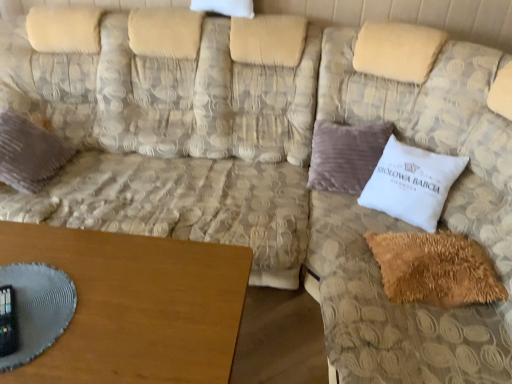
Describe the element at coordinates (435, 268) in the screenshot. I see `brown fuzzy pillow at lower right, placed as the second pillow when sorted from left to right` at that location.

This screenshot has width=512, height=384. Describe the element at coordinates (29, 153) in the screenshot. I see `velvet purple pillow at left, which ranks as the first pillow in left-to-right order` at that location.

In order to face white soft pillow at center right, the third pillow from the left, should I rotate leftwards or rightwards?

It's best to rotate right around 19.901 degrees.

Describe the element at coordinates (411, 183) in the screenshot. I see `white soft pillow at center right, the third pillow from the left` at that location.

Where is `brown fuzzy pillow at lower right, placed as the second pillow when sorted from left to right`? brown fuzzy pillow at lower right, placed as the second pillow when sorted from left to right is located at coordinates (435, 268).

Between point (80, 171) and point (438, 186), which one is positioned behind?

The point (80, 171) is farther.

Is beige textured couch at center, the 2th couch when ordered from right to left, positioned before white soft pillow at center right, the third pillow from the left?

Yes.

Could you tell me if beige textured couch at center, which appears as the first couch when viewed from the left, is facing white soft pillow at center right, placed as the first pillow when sorted from right to left?

No, beige textured couch at center, which appears as the first couch when viewed from the left, is not turned towards white soft pillow at center right, placed as the first pillow when sorted from right to left.

Based on their sizes in the image, would you say beige textured couch at center, the 2th couch when ordered from right to left, is bigger or smaller than white soft pillow at center right, placed as the first pillow when sorted from right to left?

Considering their sizes, beige textured couch at center, the 2th couch when ordered from right to left, takes up more space than white soft pillow at center right, placed as the first pillow when sorted from right to left.

From the image's perspective, is beige textured couch at center, which appears as the first couch when viewed from the left, below brown fuzzy pillow at lower right, positioned as the 2th pillow in right-to-left order?

No, from the image's perspective, beige textured couch at center, which appears as the first couch when viewed from the left, is not below brown fuzzy pillow at lower right, positioned as the 2th pillow in right-to-left order.

Is the depth of beige textured couch at center, which appears as the first couch when viewed from the left, less than that of brown fuzzy pillow at lower right, placed as the second pillow when sorted from left to right?

Yes, it is in front of brown fuzzy pillow at lower right, placed as the second pillow when sorted from left to right.

Which of these two, beige textured couch at center, which appears as the first couch when viewed from the left, or brown fuzzy pillow at lower right, placed as the second pillow when sorted from left to right, stands shorter?

brown fuzzy pillow at lower right, placed as the second pillow when sorted from left to right, is shorter.

Can you confirm if brown fuzzy pillow at lower right, positioned as the 2th pillow in right-to-left order, is positioned to the right of beige textured couch at center, which appears as the first couch when viewed from the left?

Yes.

Considering the points (418, 277) and (69, 98), which point is in front, point (418, 277) or point (69, 98)?

The point (418, 277) is closer to the camera.

Is brown fuzzy pillow at lower right, positioned as the 2th pillow in right-to-left order, completely or partially outside of beige textured couch at center, which appears as the first couch when viewed from the left?

brown fuzzy pillow at lower right, positioned as the 2th pillow in right-to-left order, is positioned outside beige textured couch at center, which appears as the first couch when viewed from the left.

Is velvet purple pillow at left, which is the third pillow from right to left, behind brown wooden table at lower left?

Yes, the depth of velvet purple pillow at left, which is the third pillow from right to left, is greater than that of brown wooden table at lower left.

Is velvet purple pillow at left, which is the third pillow from right to left, oriented away from brown wooden table at lower left?

No, velvet purple pillow at left, which is the third pillow from right to left,'s orientation is not away from brown wooden table at lower left.

Which is more to the right, velvet purple pillow at left, which ranks as the first pillow in left-to-right order, or brown wooden table at lower left?

From the viewer's perspective, brown wooden table at lower left appears more on the right side.

Starting from the velvet purple pillow at left, which is the third pillow from right to left, which pillow is the 1st one to the right? Please provide its 2D coordinates.

[(435, 268)]

Can you confirm if brown fuzzy pillow at lower right, placed as the second pillow when sorted from left to right, is thinner than velvet purple pillow at left, which ranks as the first pillow in left-to-right order?

In fact, brown fuzzy pillow at lower right, placed as the second pillow when sorted from left to right, might be wider than velvet purple pillow at left, which ranks as the first pillow in left-to-right order.

Is point (404, 266) closer or farther from the camera than point (18, 122)?

Clearly, point (404, 266) is closer to the camera than point (18, 122).

Considering their positions, is brown wooden table at lower left located in front of or behind brown fuzzy pillow at lower right, placed as the second pillow when sorted from left to right?

brown wooden table at lower left is positioned closer to the viewer than brown fuzzy pillow at lower right, placed as the second pillow when sorted from left to right.

Is brown wooden table at lower left completely or partially outside of brown fuzzy pillow at lower right, placed as the second pillow when sorted from left to right?

Yes, brown wooden table at lower left is located beyond the bounds of brown fuzzy pillow at lower right, placed as the second pillow when sorted from left to right.

Who is bigger, brown wooden table at lower left or brown fuzzy pillow at lower right, positioned as the 2th pillow in right-to-left order?

Bigger between the two is brown wooden table at lower left.

How many degrees apart are the facing directions of beige textured couch at center, the 2th couch when ordered from right to left, and beige textured couch at upper right, positioned as the 1th couch in right-to-left order?

beige textured couch at center, the 2th couch when ordered from right to left, and beige textured couch at upper right, positioned as the 1th couch in right-to-left order, are facing 89.9 degrees away from each other.

Is beige textured couch at upper right, positioned as the 1th couch in right-to-left order, at the back of beige textured couch at center, which appears as the first couch when viewed from the left?

No, beige textured couch at center, which appears as the first couch when viewed from the left, is not facing away from beige textured couch at upper right, positioned as the 1th couch in right-to-left order.

Would you say beige textured couch at center, the 2th couch when ordered from right to left, contains beige textured couch at upper right, marked as the 2th couch in a left-to-right arrangement?

No, beige textured couch at upper right, marked as the 2th couch in a left-to-right arrangement, is not a part of beige textured couch at center, the 2th couch when ordered from right to left.

From the picture: Can you confirm if beige textured couch at center, which appears as the first couch when viewed from the left, is wider than beige textured couch at upper right, positioned as the 1th couch in right-to-left order?

No.

You are a GUI agent. You are given a task and a screenshot of the screen. Output one action in this format:
    pyautogui.click(x=<x>, y=<y>)
    Task: Click on the couch that is the 1st object above the white soft pillow at center right, the third pillow from the left (from a real-world perspective)
    
    Given the screenshot: What is the action you would take?
    pyautogui.click(x=177, y=130)

Find the location of a particular element. This screenshot has height=384, width=512. the 3rd pillow positioned below the beige textured couch at center, which appears as the first couch when viewed from the left (from the image's perspective) is located at coordinates (435, 268).

When comparing their distances from white soft pillow at center right, the third pillow from the left, does brown fuzzy pillow at lower right, positioned as the 2th pillow in right-to-left order, or beige textured couch at center, which appears as the first couch when viewed from the left, seem further?

The object further to white soft pillow at center right, the third pillow from the left, is beige textured couch at center, which appears as the first couch when viewed from the left.

Estimate the real-world distances between objects in this image. Which object is further from velvet purple pillow at left, which is the third pillow from right to left, brown fuzzy pillow at lower right, positioned as the 2th pillow in right-to-left order, or white soft pillow at center right, the third pillow from the left?

brown fuzzy pillow at lower right, positioned as the 2th pillow in right-to-left order, is positioned further to the anchor velvet purple pillow at left, which is the third pillow from right to left.

Looking at this image, looking at the image, which one is located further to beige textured couch at center, the 2th couch when ordered from right to left, beige textured couch at upper right, positioned as the 1th couch in right-to-left order, or white soft pillow at center right, placed as the first pillow when sorted from right to left?

white soft pillow at center right, placed as the first pillow when sorted from right to left, lies further to beige textured couch at center, the 2th couch when ordered from right to left, than the other object.

In the scene shown: Looking at the image, which one is located closer to brown fuzzy pillow at lower right, placed as the second pillow when sorted from left to right, brown wooden table at lower left or beige textured couch at center, which appears as the first couch when viewed from the left?

The object closer to brown fuzzy pillow at lower right, placed as the second pillow when sorted from left to right, is brown wooden table at lower left.

From the picture: Based on their spatial positions, is beige textured couch at center, which appears as the first couch when viewed from the left, or brown fuzzy pillow at lower right, placed as the second pillow when sorted from left to right, closer to white soft pillow at center right, placed as the first pillow when sorted from right to left?

brown fuzzy pillow at lower right, placed as the second pillow when sorted from left to right, is positioned closer to the anchor white soft pillow at center right, placed as the first pillow when sorted from right to left.

Estimate the real-world distances between objects in this image. Which object is closer to beige textured couch at center, which appears as the first couch when viewed from the left, brown wooden table at lower left or velvet purple pillow at left, which ranks as the first pillow in left-to-right order?

Based on the image, velvet purple pillow at left, which ranks as the first pillow in left-to-right order, appears to be nearer to beige textured couch at center, which appears as the first couch when viewed from the left.

Estimate the real-world distances between objects in this image. Which object is closer to velvet purple pillow at left, which is the third pillow from right to left, brown wooden table at lower left or beige textured couch at upper right, positioned as the 1th couch in right-to-left order?

Among the two, brown wooden table at lower left is located nearer to velvet purple pillow at left, which is the third pillow from right to left.

When comparing their distances from beige textured couch at upper right, positioned as the 1th couch in right-to-left order, does brown fuzzy pillow at lower right, placed as the second pillow when sorted from left to right, or white soft pillow at center right, the third pillow from the left, seem further?

brown fuzzy pillow at lower right, placed as the second pillow when sorted from left to right, is positioned further to the anchor beige textured couch at upper right, positioned as the 1th couch in right-to-left order.

Where is `table situated between beige textured couch at center, the 2th couch when ordered from right to left, and beige textured couch at upper right, marked as the 2th couch in a left-to-right arrangement, from left to right`? table situated between beige textured couch at center, the 2th couch when ordered from right to left, and beige textured couch at upper right, marked as the 2th couch in a left-to-right arrangement, from left to right is located at coordinates (136, 306).

This screenshot has width=512, height=384. In order to click on table between beige textured couch at center, the 2th couch when ordered from right to left, and brown fuzzy pillow at lower right, positioned as the 2th pillow in right-to-left order, from left to right in this screenshot , I will do `click(136, 306)`.

Locate an element on the screen. pillow between beige textured couch at center, which appears as the first couch when viewed from the left, and white soft pillow at center right, placed as the first pillow when sorted from right to left, from left to right is located at coordinates (435, 268).

Where is `couch between velvet purple pillow at left, which is the third pillow from right to left, and brown fuzzy pillow at lower right, placed as the second pillow when sorted from left to right, in the horizontal direction`? couch between velvet purple pillow at left, which is the third pillow from right to left, and brown fuzzy pillow at lower right, placed as the second pillow when sorted from left to right, in the horizontal direction is located at coordinates (177, 130).